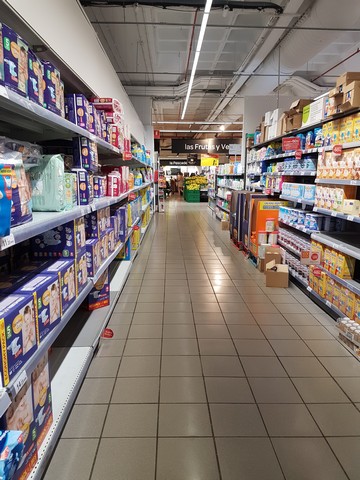
Where is `1 type of tile used for flooring`? Image resolution: width=360 pixels, height=480 pixels. 1 type of tile used for flooring is located at coordinates (258, 456).